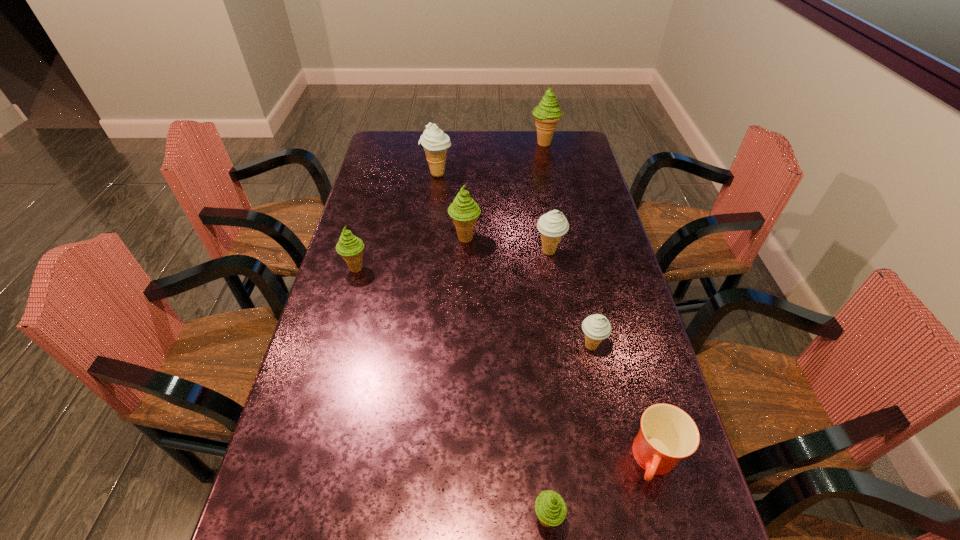
Identify the location of free space between the second nearest object and the second nearest beige icecream. (602, 356).

Find the location of a particular element. The image size is (960, 540). empty location between the second object from left to right and the nearest beige icecream is located at coordinates click(x=515, y=260).

I want to click on free space that is in between the smallest beige icecream and the nearest icecream, so click(x=569, y=433).

What are the coordinates of `free area in between the fifth object from right to left and the second farthest green icecream` in the screenshot? It's located at (506, 379).

The height and width of the screenshot is (540, 960). I want to click on free space between the third green icecream from right to left and the cup, so click(560, 349).

Locate an element on the screen. The height and width of the screenshot is (540, 960). vacant area that lies between the third green icecream from left to right and the cup is located at coordinates point(601,490).

Where is `empty space that is in between the second green icecream from left to right and the nearest beige icecream`? This screenshot has width=960, height=540. empty space that is in between the second green icecream from left to right and the nearest beige icecream is located at coordinates (528, 292).

This screenshot has height=540, width=960. In order to click on free space between the third nearest object and the second biggest beige icecream in this screenshot , I will do `click(570, 299)`.

Locate an element on the screen. vacant area that lies between the sixth farthest icecream and the nearest object is located at coordinates (569, 433).

This screenshot has height=540, width=960. I want to click on vacant point located between the tallest object and the second nearest beige icecream, so click(x=546, y=197).